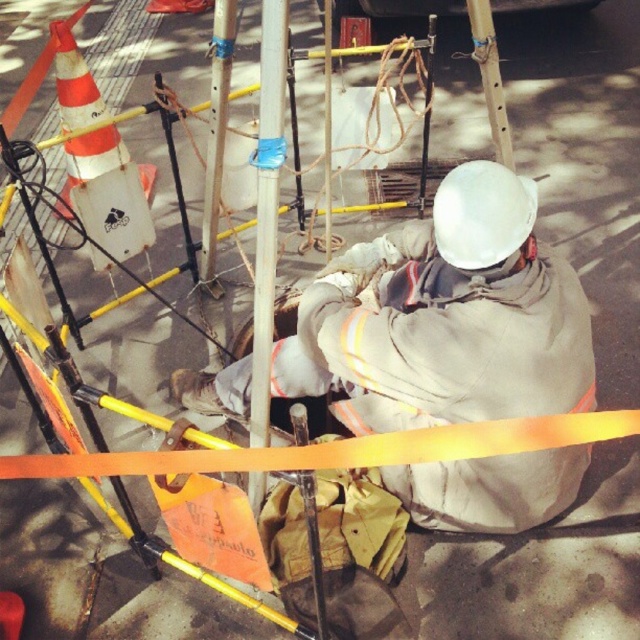
Can you confirm if orange reflective traffic cone at upper left is wider than smooth white pole at center?

Yes, orange reflective traffic cone at upper left is wider than smooth white pole at center.

Between orange reflective traffic cone at upper left and smooth white pole at center, which one is positioned lower?

smooth white pole at center is lower down.

Between point (58, 108) and point (220, 157), which one is positioned behind?

Positioned behind is point (58, 108).

Locate an element on the screen. orange reflective traffic cone at upper left is located at coordinates (81, 116).

Does gray fabric construction worker at center lie behind blue tape on metal pole at center?

Yes, gray fabric construction worker at center is further from the viewer.

Between gray fabric construction worker at center and blue tape on metal pole at center, which one has less height?

With less height is gray fabric construction worker at center.

The width and height of the screenshot is (640, 640). What do you see at coordinates (445, 317) in the screenshot?
I see `gray fabric construction worker at center` at bounding box center [445, 317].

Identify the location of gray fabric construction worker at center. (445, 317).

Is gray fabric construction worker at center above orange reflective traffic cone at upper left?

Incorrect, gray fabric construction worker at center is not positioned above orange reflective traffic cone at upper left.

Is gray fabric construction worker at center bigger than orange reflective traffic cone at upper left?

Yes, gray fabric construction worker at center is bigger than orange reflective traffic cone at upper left.

Which is behind, point (532, 355) or point (92, 74)?

The point (92, 74) is behind.

The width and height of the screenshot is (640, 640). In order to click on gray fabric construction worker at center in this screenshot , I will do `click(445, 317)`.